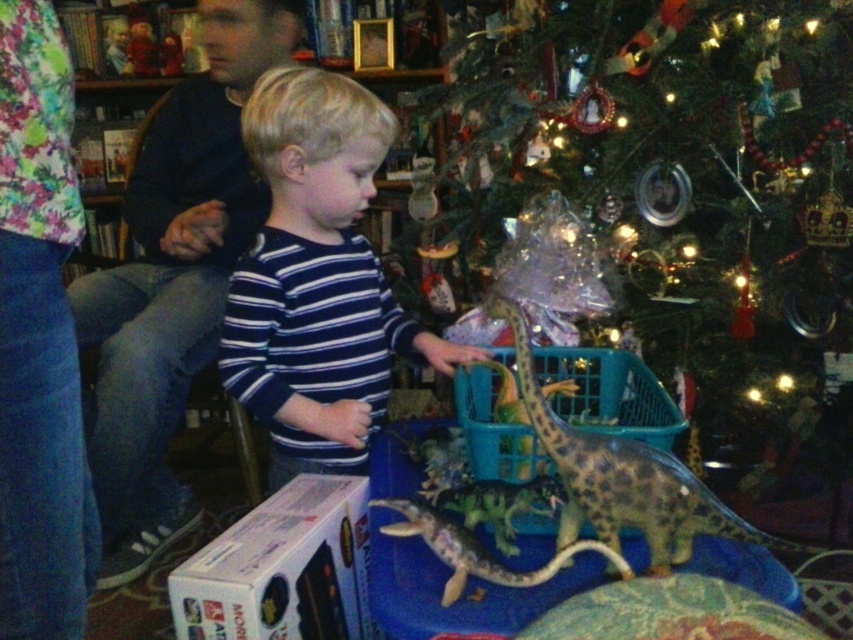
Who is more distant from viewer, (697, 250) or (612, 552)?

Positioned behind is point (697, 250).

Locate an element on the screen. The width and height of the screenshot is (853, 640). shiny green tree at center is located at coordinates (677, 170).

In the scene shown: Who is shorter, blue striped shirt at center or shiny metallic dinosaur at center?

shiny metallic dinosaur at center

Who is higher up, blue striped shirt at center or shiny metallic dinosaur at center?

blue striped shirt at center

In order to click on blue striped shirt at center in this screenshot , I will do `click(316, 278)`.

Find the location of a particular element. This screenshot has height=640, width=853. blue striped shirt at center is located at coordinates (316, 278).

Find the location of a particular element. This screenshot has height=640, width=853. shiny green tree at center is located at coordinates (677, 170).

Which of these two, shiny green tree at center or blue striped shirt at center, stands shorter?

Standing shorter between the two is blue striped shirt at center.

You are a GUI agent. You are given a task and a screenshot of the screen. Output one action in this format:
    pyautogui.click(x=<x>, y=<y>)
    Task: Click on the shiny green tree at center
    This screenshot has width=853, height=640.
    Given the screenshot: What is the action you would take?
    click(677, 170)

I want to click on shiny green tree at center, so click(x=677, y=170).